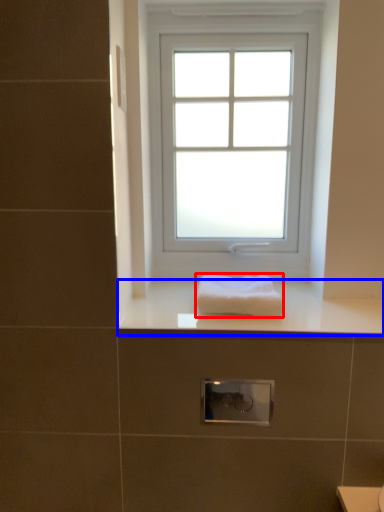
Question: Which of the following is the closest to the observer, towel (highlighted by a red box) or counter top (highlighted by a blue box)?

Choices:
 (A) towel
 (B) counter top

Answer: (B)